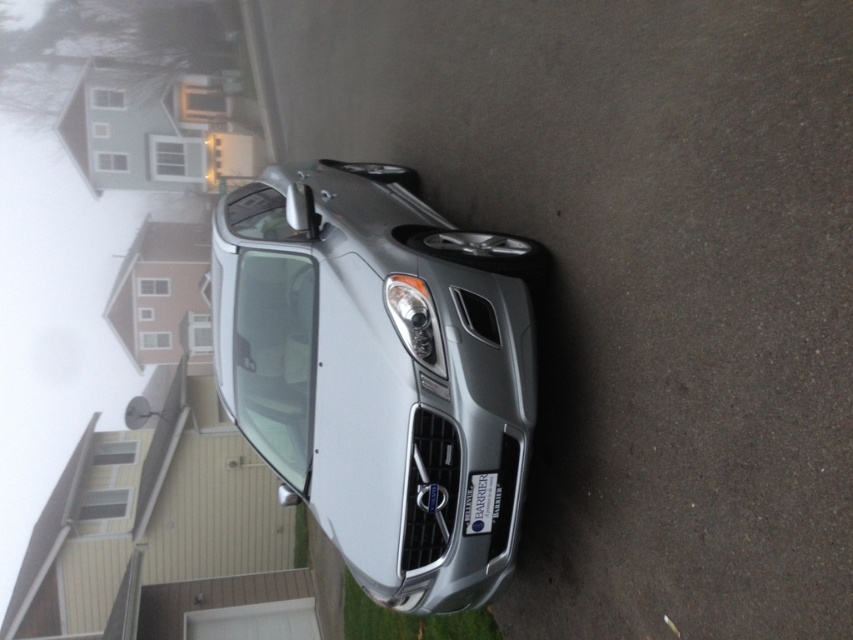
You are a delivery driver who needs to park your vehicle in this residential area. The parking spot is marked by a point at coordinates (379, 371). What object is located at this point?

The point at coordinates (379, 371) indicates the satin silver car at center.

You are a delivery person trying to park your van between the silver metallic car at center and the satin silver car at center. Your van is 2.5 meters long. Is there enough space between them to park your van?

The silver metallic car at center and the satin silver car at center are 1.16 meters apart from each other. Since your van is 2.5 meters long, there is not enough space to park between them.